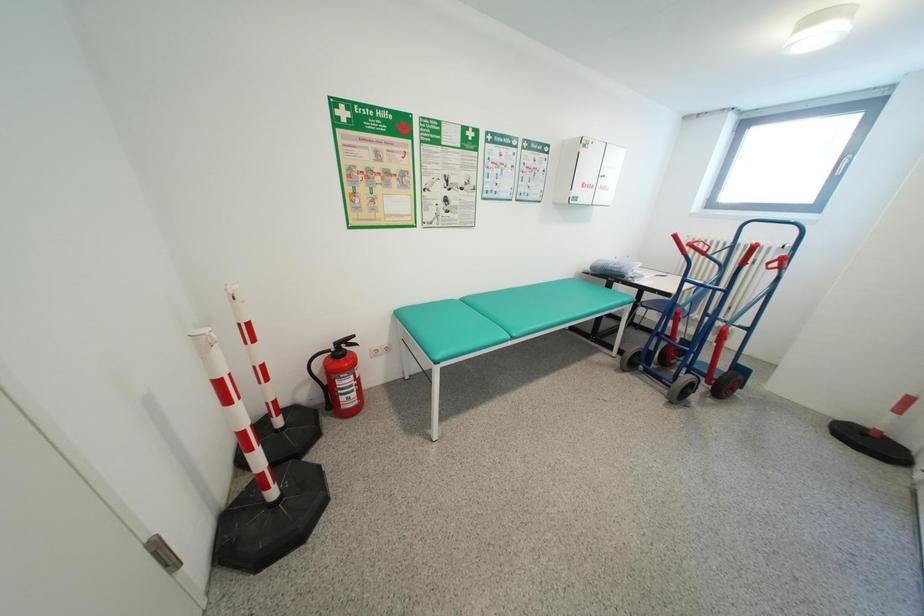
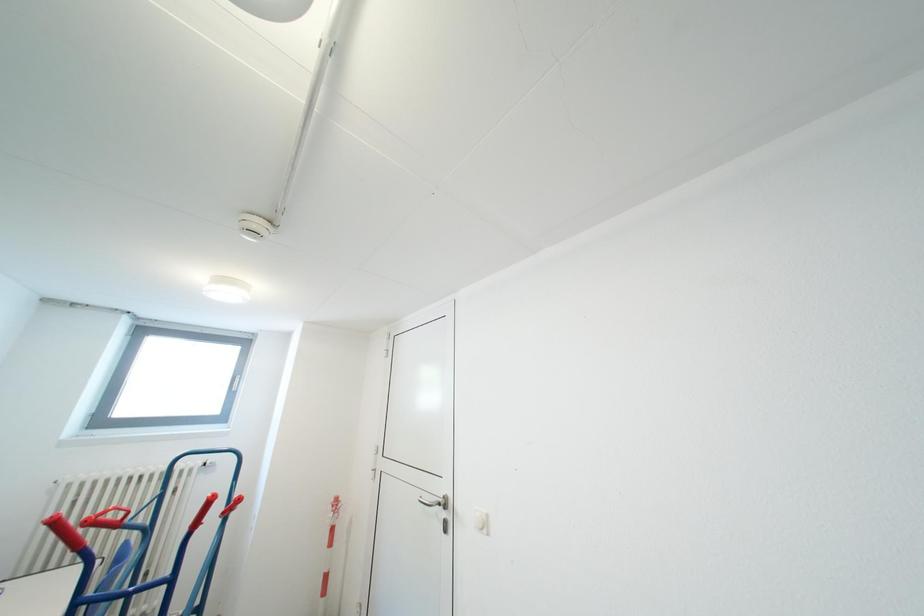
Question: The images are taken continuously from a first-person perspective. In which direction is your viewpoint rotating?

Choices:
 (A) Left
 (B) Right
 (C) Up
 (D) Down

Answer: (B)